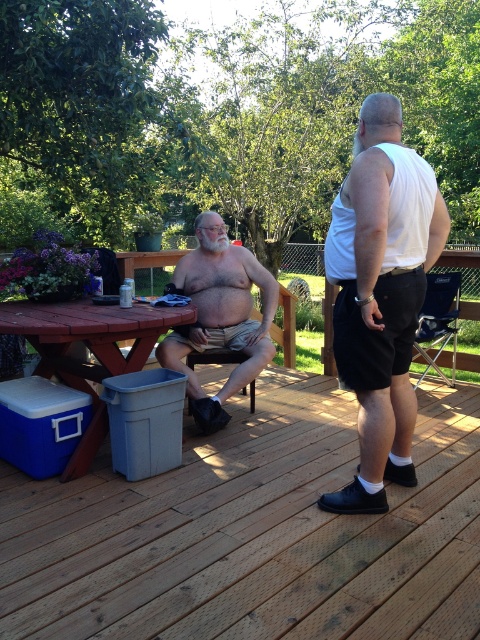
Does white matte tank top at center have a lesser width compared to beige cotton shorts at center?

Correct, white matte tank top at center's width is less than beige cotton shorts at center's.

Which is below, white matte tank top at center or beige cotton shorts at center?

beige cotton shorts at center is lower down.

Is point (383, 252) farther from viewer compared to point (169, 285)?

No, it is not.

You are a GUI agent. You are given a task and a screenshot of the screen. Output one action in this format:
    pyautogui.click(x=<x>, y=<y>)
    Task: Click on the white matte tank top at center
    The height and width of the screenshot is (640, 480).
    Given the screenshot: What is the action you would take?
    pyautogui.click(x=381, y=294)

Does wooden deck at center have a greater width compared to beige cotton shorts at center?

Correct, the width of wooden deck at center exceeds that of beige cotton shorts at center.

Is wooden deck at center taller than beige cotton shorts at center?

No.

Find the location of `wooden deck at center`. wooden deck at center is located at coordinates (253, 532).

Between wooden deck at center and white matte tank top at center, which one appears on the right side from the viewer's perspective?

white matte tank top at center

Can you confirm if wooden deck at center is positioned to the right of white matte tank top at center?

Incorrect, wooden deck at center is not on the right side of white matte tank top at center.

Who is more forward, [467,515] or [386,388]?

Point [386,388] is more forward.

Where is `wooden deck at center`? The image size is (480, 640). wooden deck at center is located at coordinates (253, 532).